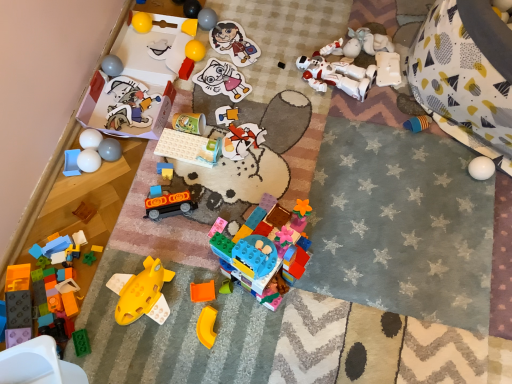
Locate an element on the screen. This screenshot has height=384, width=512. free space between matte plastic blocks at center, which appears as the fifteenth toy when viewed from the right, and yellow matte plastic piece at center, the seventh toy when ordered from right to left is located at coordinates (186, 258).